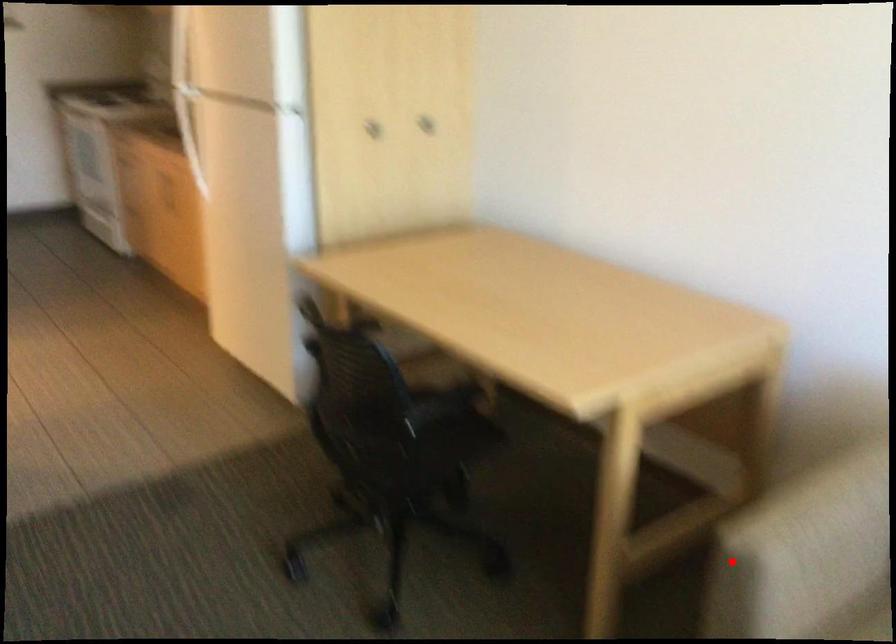
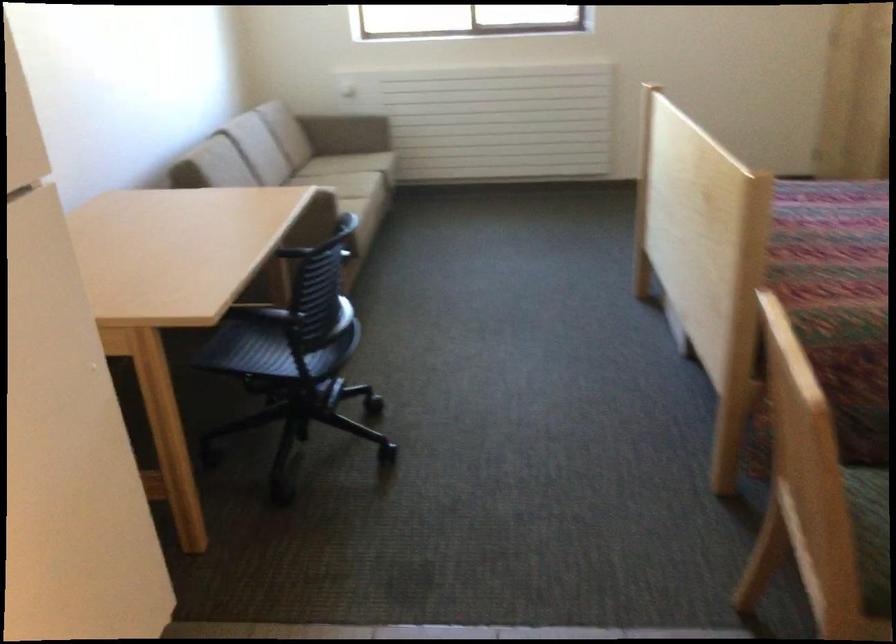
The point at the highlighted location is marked in the first image. Where is the corresponding point in the second image?

(328, 198)